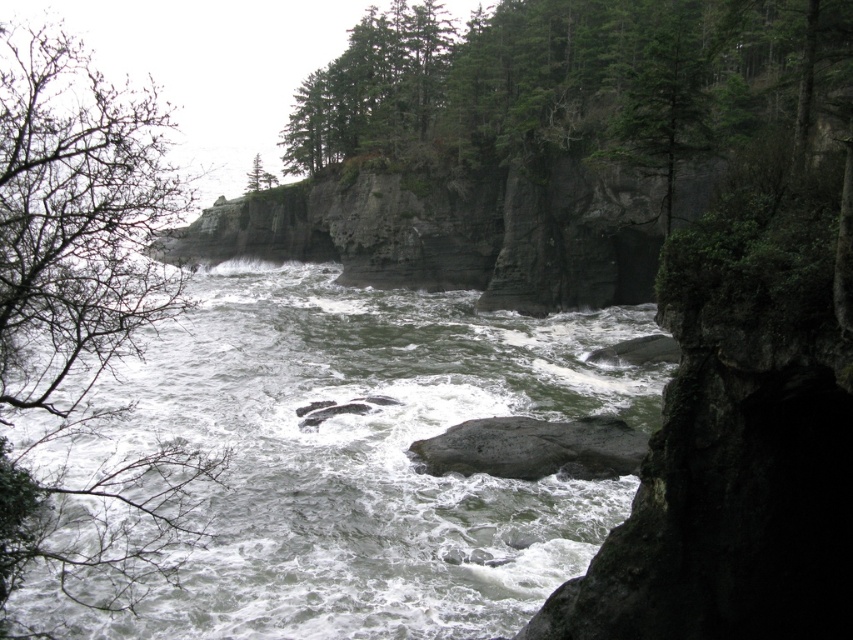
Question: Does bare branches at left appear over gray rough rock at center?

Choices:
 (A) yes
 (B) no

Answer: (A)

Question: Which object is closer to the camera taking this photo?

Choices:
 (A) green matte tree at upper center
 (B) gray rough rock at center

Answer: (B)

Question: Can you confirm if gray rough rock at center is wider than green matte tree at upper center?

Choices:
 (A) yes
 (B) no

Answer: (B)

Question: Estimate the real-world distances between objects in this image. Which object is closer to the green matte tree at upper center?

Choices:
 (A) greenish-gray water at center
 (B) gray rough rock at center

Answer: (A)

Question: Among these objects, which one is farthest from the camera?

Choices:
 (A) gray rough rock at center
 (B) bare branches at left
 (C) green matte tree at upper center

Answer: (C)

Question: Is bare branches at left closer to the viewer compared to green matte tree at upper center?

Choices:
 (A) yes
 (B) no

Answer: (A)